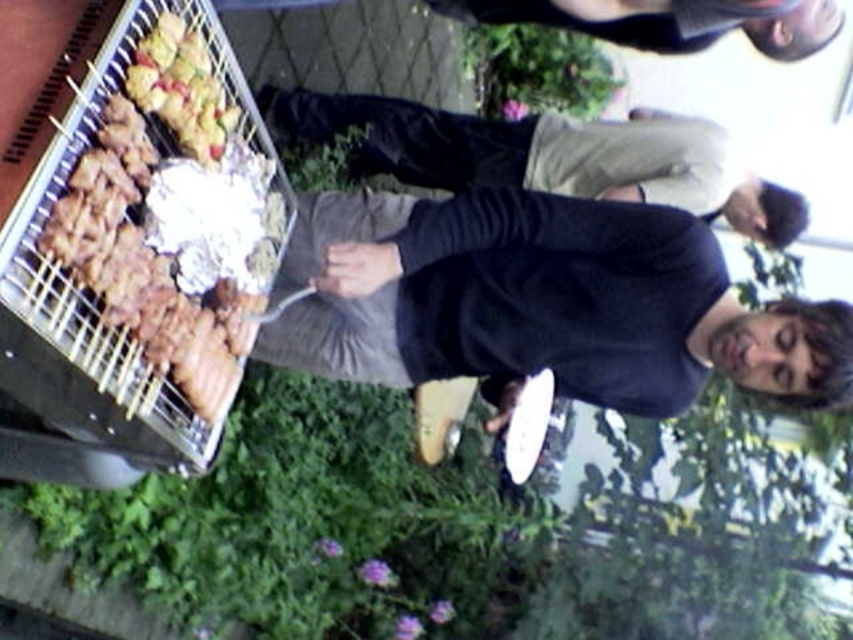
Which is in front, point (6, 353) or point (210, 108)?

Point (6, 353)

Does metallic grill at left have a smaller size compared to golden brown skewers at upper left?

Actually, metallic grill at left might be larger than golden brown skewers at upper left.

Where is `metallic grill at left`? The height and width of the screenshot is (640, 853). metallic grill at left is located at coordinates (85, 289).

The width and height of the screenshot is (853, 640). Identify the location of dark gray sweater at center. (521, 298).

In the scene shown: Is dark gray sweater at center in front of dark gray pants at center?

That is True.

Does point (428, 342) come closer to viewer compared to point (306, 93)?

That is True.

Where is `dark gray sweater at center`? Image resolution: width=853 pixels, height=640 pixels. dark gray sweater at center is located at coordinates (521, 298).

The height and width of the screenshot is (640, 853). Describe the element at coordinates (85, 289) in the screenshot. I see `metallic grill at left` at that location.

Who is positioned more to the left, metallic grill at left or dark gray sweater at upper center?

metallic grill at left

What do you see at coordinates (85, 289) in the screenshot?
I see `metallic grill at left` at bounding box center [85, 289].

Where is `metallic grill at left`? metallic grill at left is located at coordinates pos(85,289).